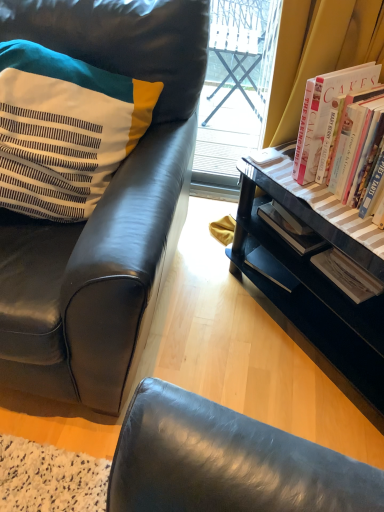
Question: From a real-world perspective, does black wood desk at lower right sit lower than black leather chair at left?

Choices:
 (A) yes
 (B) no

Answer: (A)

Question: Is black wood desk at lower right facing away from black leather chair at left?

Choices:
 (A) yes
 (B) no

Answer: (B)

Question: Considering the relative positions of black wood desk at lower right and black leather chair at left in the image provided, is black wood desk at lower right to the left of black leather chair at left from the viewer's perspective?

Choices:
 (A) no
 (B) yes

Answer: (A)

Question: Does black wood desk at lower right have a larger size compared to black leather chair at left?

Choices:
 (A) yes
 (B) no

Answer: (B)

Question: Could you tell me if black wood desk at lower right is facing black leather chair at left?

Choices:
 (A) no
 (B) yes

Answer: (B)

Question: Is black wood desk at lower right in front of or behind striped fabric pillow at left in the image?

Choices:
 (A) behind
 (B) front

Answer: (A)

Question: From a real-world perspective, is black wood desk at lower right positioned above or below striped fabric pillow at left?

Choices:
 (A) below
 (B) above

Answer: (A)

Question: From the image's perspective, is black wood desk at lower right positioned above or below striped fabric pillow at left?

Choices:
 (A) below
 (B) above

Answer: (A)

Question: Is black wood desk at lower right to the left or to the right of striped fabric pillow at left in the image?

Choices:
 (A) right
 (B) left

Answer: (A)

Question: Considering the positions of hardcover books at right and striped fabric pillow at left in the image, is hardcover books at right wider or thinner than striped fabric pillow at left?

Choices:
 (A) wide
 (B) thin

Answer: (B)

Question: Is hardcover books at right spatially inside striped fabric pillow at left, or outside of it?

Choices:
 (A) outside
 (B) inside

Answer: (A)

Question: From a real-world perspective, is hardcover books at right positioned above or below striped fabric pillow at left?

Choices:
 (A) below
 (B) above

Answer: (A)

Question: In terms of size, does hardcover books at right appear bigger or smaller than striped fabric pillow at left?

Choices:
 (A) big
 (B) small

Answer: (B)

Question: Is striped fabric pillow at left bigger or smaller than black wood desk at lower right?

Choices:
 (A) small
 (B) big

Answer: (A)

Question: Is striped fabric pillow at left spatially inside black wood desk at lower right, or outside of it?

Choices:
 (A) inside
 (B) outside

Answer: (B)